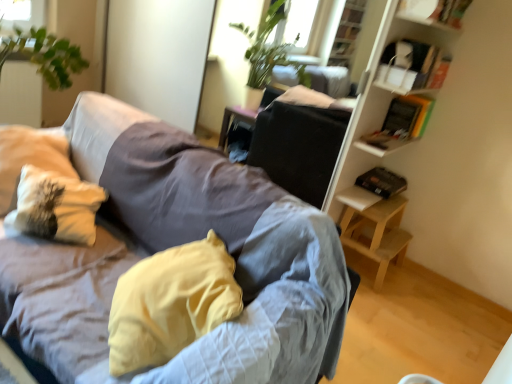
Question: Is yellow fabric pillow at center, the 2th pillow when ordered from left to right, to the left or to the right of textured gray couch at center in the image?

Choices:
 (A) right
 (B) left

Answer: (A)

Question: From a real-world perspective, is yellow fabric pillow at center, which is counted as the first pillow, starting from the right, positioned above or below textured gray couch at center?

Choices:
 (A) below
 (B) above

Answer: (B)

Question: Which is farther from the yellow fabric pillow at center, which is counted as the first pillow, starting from the right?

Choices:
 (A) light wood table at lower right
 (B) white textured pillow at left, marked as the second pillow in a right-to-left arrangement
 (C) white cardboard box at upper right, which is counted as the second shelf, starting from the top
 (D) wooden bookshelf at right
 (E) wooden bookshelf at upper right, which is the second shelf in bottom-to-top order

Answer: (E)

Question: Estimate the real-world distances between objects in this image. Which object is farther from the wooden bookshelf at right?

Choices:
 (A) light wood table at lower right
 (B) white textured pillow at left, which is the 1th pillow in left-to-right order
 (C) yellow fabric pillow at center, the 2th pillow when ordered from left to right
 (D) white cardboard box at upper right, which is counted as the second shelf, starting from the top
 (E) wooden bookshelf at upper right, which is the first shelf from top to bottom

Answer: (B)